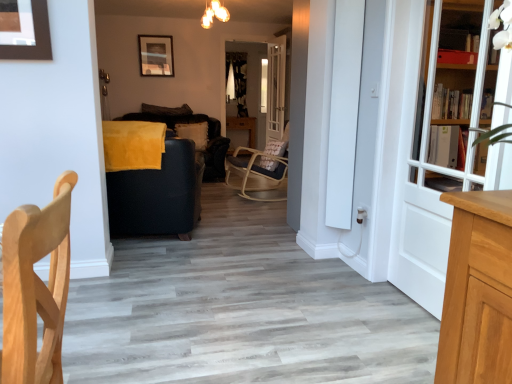
Question: Is point (168, 223) closer or farther from the camera than point (446, 16)?

Choices:
 (A) farther
 (B) closer

Answer: (A)

Question: Considering the relative positions of velvet black armchair at center, the second chair when ordered from front to back, and white wooden bookcase at right in the image provided, is velvet black armchair at center, the second chair when ordered from front to back, to the left or to the right of white wooden bookcase at right?

Choices:
 (A) right
 (B) left

Answer: (B)

Question: Which of these objects is positioned farthest from the velvet black armchair at center, the second chair when ordered from front to back?

Choices:
 (A) white wooden door at right, which is the 2th door in top-to-bottom order
 (B) warm glass chandelier at upper center
 (C) white wooden bookcase at right
 (D) matte black picture frame at upper center
 (E) suede-like brown pillow at center, the first pillow when ordered from top to bottom

Answer: (D)

Question: Considering the real-world distances, which object is farthest from the matte black picture frame at upper center?

Choices:
 (A) beige textured pillow at center, the second pillow viewed from the top
 (B) velvet black armchair at center, which is the 1th chair in back-to-front order
 (C) white wooden bookcase at right
 (D) warm glass chandelier at upper center
 (E) suede-like brown pillow at center, the first pillow when ordered from top to bottom

Answer: (C)